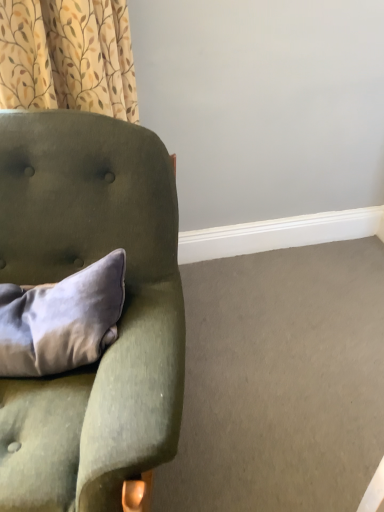
Question: From the image's perspective, is patterned fabric curtain at upper left on top of satin gray pillow at left?

Choices:
 (A) no
 (B) yes

Answer: (B)

Question: Is patterned fabric curtain at upper left located outside satin gray pillow at left?

Choices:
 (A) yes
 (B) no

Answer: (A)

Question: From a real-world perspective, does patterned fabric curtain at upper left sit lower than satin gray pillow at left?

Choices:
 (A) no
 (B) yes

Answer: (A)

Question: Can you confirm if patterned fabric curtain at upper left is bigger than satin gray pillow at left?

Choices:
 (A) yes
 (B) no

Answer: (A)

Question: Can you confirm if patterned fabric curtain at upper left is smaller than satin gray pillow at left?

Choices:
 (A) no
 (B) yes

Answer: (A)

Question: Is patterned fabric curtain at upper left turned away from satin gray pillow at left?

Choices:
 (A) yes
 (B) no

Answer: (B)

Question: Considering the relative sizes of satin gray pillow at left and velvet green armchair at left in the image provided, is satin gray pillow at left wider than velvet green armchair at left?

Choices:
 (A) yes
 (B) no

Answer: (B)

Question: From the image's perspective, is satin gray pillow at left below velvet green armchair at left?

Choices:
 (A) yes
 (B) no

Answer: (B)

Question: Considering the relative positions of satin gray pillow at left and velvet green armchair at left in the image provided, is satin gray pillow at left to the right of velvet green armchair at left from the viewer's perspective?

Choices:
 (A) yes
 (B) no

Answer: (A)

Question: Considering the relative sizes of satin gray pillow at left and velvet green armchair at left in the image provided, is satin gray pillow at left thinner than velvet green armchair at left?

Choices:
 (A) yes
 (B) no

Answer: (A)

Question: Does satin gray pillow at left turn towards velvet green armchair at left?

Choices:
 (A) yes
 (B) no

Answer: (A)

Question: Considering the relative sizes of satin gray pillow at left and velvet green armchair at left in the image provided, is satin gray pillow at left taller than velvet green armchair at left?

Choices:
 (A) yes
 (B) no

Answer: (B)

Question: Can you confirm if velvet green armchair at left is thinner than satin gray pillow at left?

Choices:
 (A) no
 (B) yes

Answer: (A)